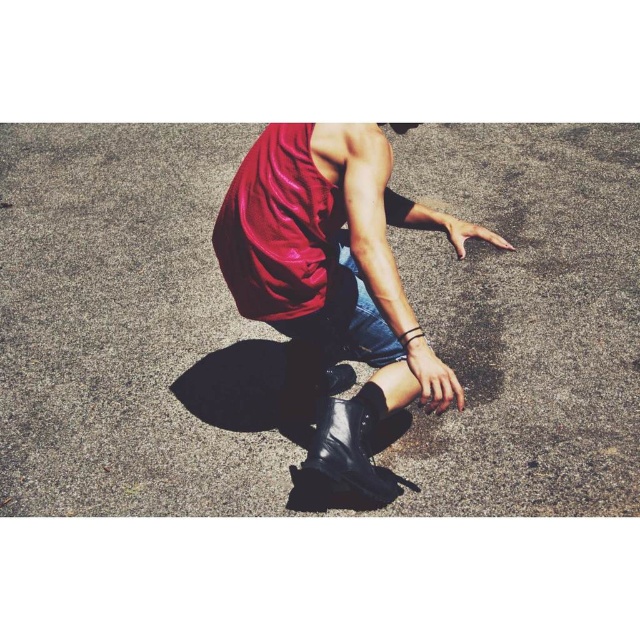
In the scene shown: You are a fashion designer observing the person in the scene. You need to determine which item of clothing is bigger in size between the shiny red tank top at center and the black leather boot at lower center. Which one is larger?

The shiny red tank top at center is larger in size compared to the black leather boot at lower center according to the description.

You are a photographer setting up a shot of the person in the scene. You want to ensure that both the shiny red tank top at center and the black leather boot at lower center are clearly visible in your photo. Based on their positions, which object should you focus on first to ensure depth of field captures both?

You should focus on the shiny red tank top at center first because it is closer to the viewer than the black leather boot at lower center. By focusing on the closer object, the depth of field will extend backward, potentially keeping both in focus.